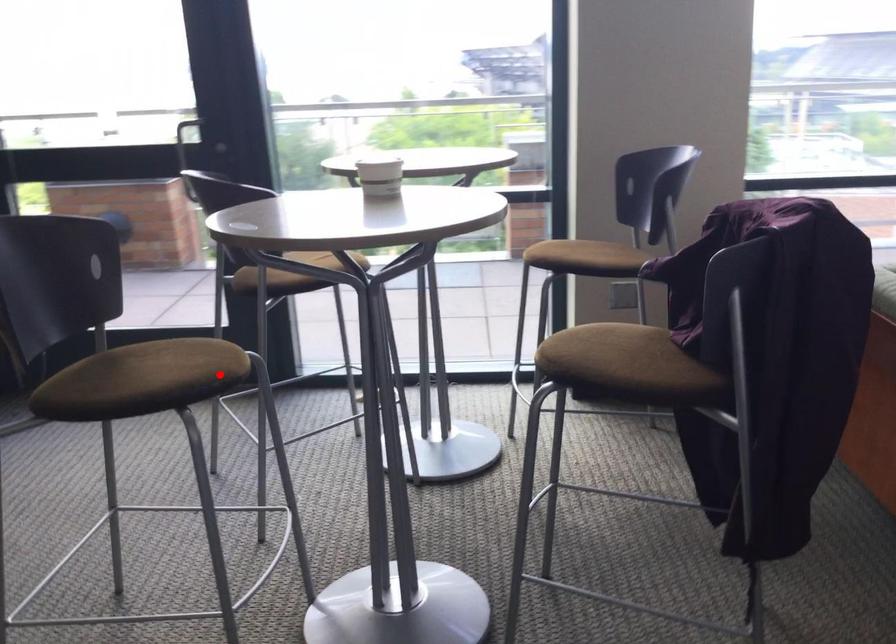
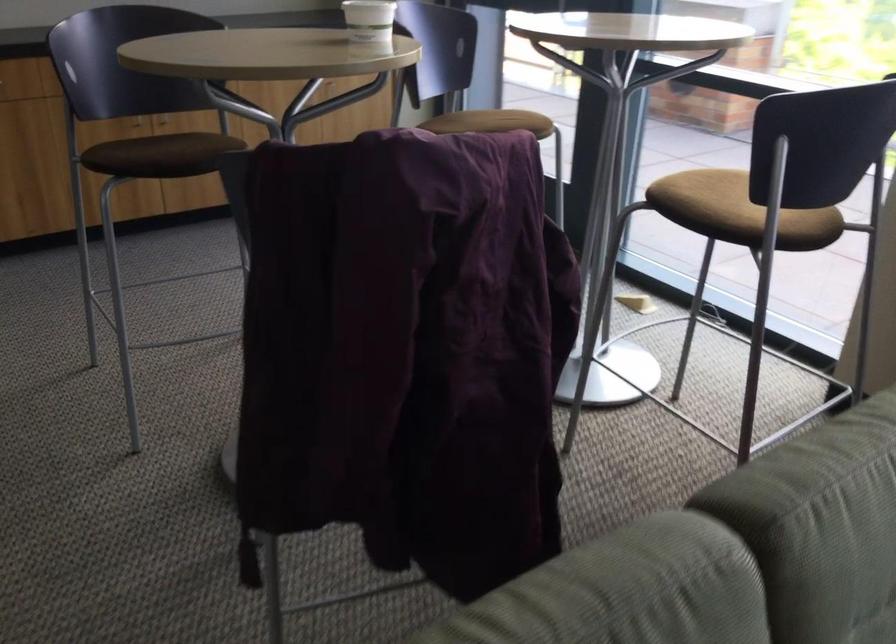
Question: I am providing you with two images of the same scene from different viewpoints. In image1, a red point is highlighted. Considering the same 3D point in image2, which of the following is correct?

Choices:
 (A) It is closer
 (B) It is farther

Answer: (B)